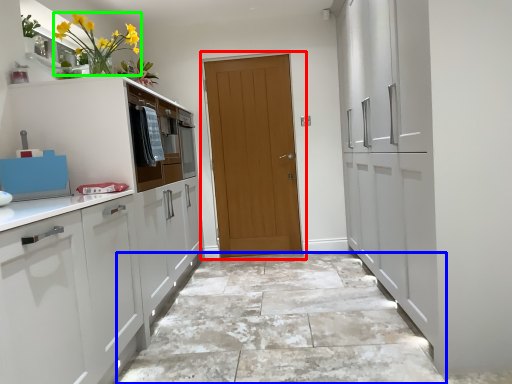
Question: Estimate the real-world distances between objects in this image. Which object is farther from door (highlighted by a red box), granite (highlighted by a blue box) or floral arrangement (highlighted by a green box)?

Choices:
 (A) granite
 (B) floral arrangement

Answer: (B)